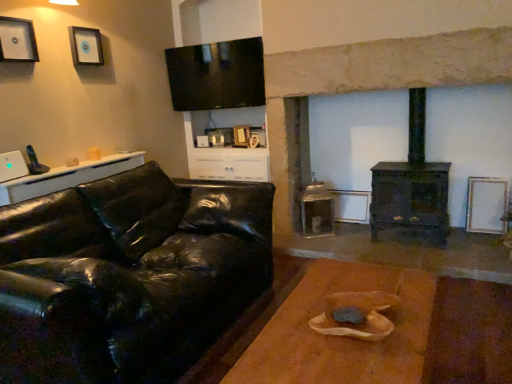
Question: Is the depth of brushed metal picture frame at upper left, positioned as the third picture frame in back-to-front order, less than that of white glossy table at left, which is the 1th table from top to bottom?

Choices:
 (A) yes
 (B) no

Answer: (B)

Question: From a real-world perspective, is brushed metal picture frame at upper left, which ranks as the third picture frame in right-to-left order, located beneath white glossy table at left, which is the second table from bottom to top?

Choices:
 (A) no
 (B) yes

Answer: (A)

Question: Is brushed metal picture frame at upper left, positioned as the third picture frame in back-to-front order, touching white glossy table at left, acting as the 2th table starting from the front?

Choices:
 (A) no
 (B) yes

Answer: (A)

Question: From the image's perspective, is brushed metal picture frame at upper left, positioned as the third picture frame in back-to-front order, located beneath white glossy table at left, which is the second table from bottom to top?

Choices:
 (A) no
 (B) yes

Answer: (A)

Question: Can you confirm if brushed metal picture frame at upper left, positioned as the third picture frame in back-to-front order, is shorter than white glossy table at left, acting as the 1th table starting from the back?

Choices:
 (A) no
 (B) yes

Answer: (A)

Question: Is the depth of brushed metal picture frame at upper left, positioned as the first picture frame in left-to-right order, greater than that of white glossy table at left, acting as the 1th table starting from the back?

Choices:
 (A) no
 (B) yes

Answer: (B)

Question: Is white glossy table at left, which is the first table from left to right, behind wooden picture frame at upper left, the 2th picture frame when ordered from right to left?

Choices:
 (A) no
 (B) yes

Answer: (A)

Question: Is white glossy table at left, positioned as the second table in right-to-left order, not inside wooden picture frame at upper left, which is the 3th picture frame from bottom to top?

Choices:
 (A) no
 (B) yes

Answer: (B)

Question: Can you confirm if white glossy table at left, acting as the 2th table starting from the front, is wider than wooden picture frame at upper left, the 2th picture frame positioned from the front?

Choices:
 (A) no
 (B) yes

Answer: (B)

Question: From a real-world perspective, is white glossy table at left, acting as the 2th table starting from the front, beneath wooden picture frame at upper left, the first picture frame in the top-to-bottom sequence?

Choices:
 (A) no
 (B) yes

Answer: (B)

Question: From the image's perspective, is white glossy table at left, acting as the 1th table starting from the back, located beneath wooden picture frame at upper left, which is the 3th picture frame from bottom to top?

Choices:
 (A) no
 (B) yes

Answer: (B)

Question: Does white glossy table at left, which is the first table from left to right, have a larger size compared to wooden picture frame at upper left, which is the 3th picture frame from bottom to top?

Choices:
 (A) yes
 (B) no

Answer: (A)

Question: Is brown wooden table at center, placed as the 1th table when sorted from bottom to top, wider than white matte picture frame at right, which appears as the third picture frame when viewed from the left?

Choices:
 (A) yes
 (B) no

Answer: (A)